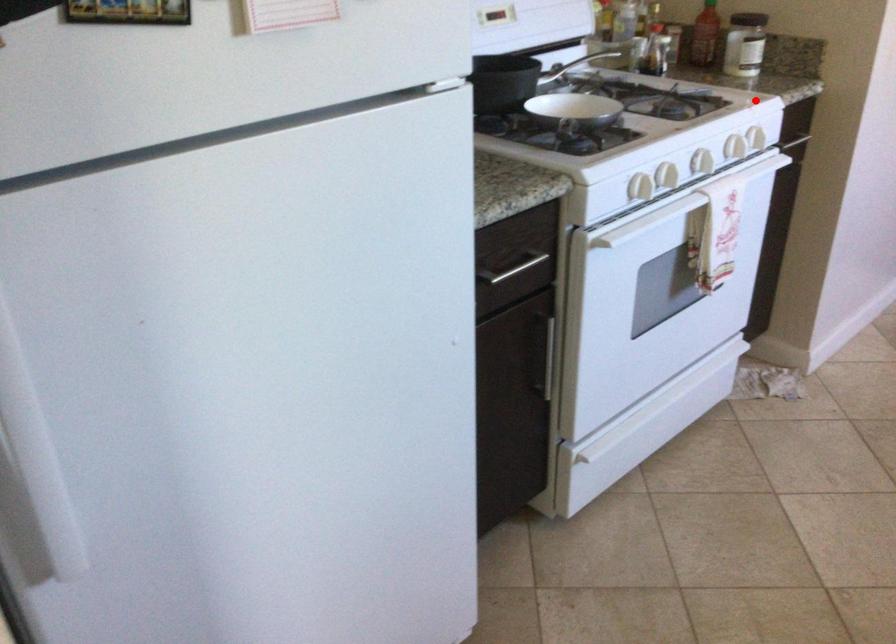
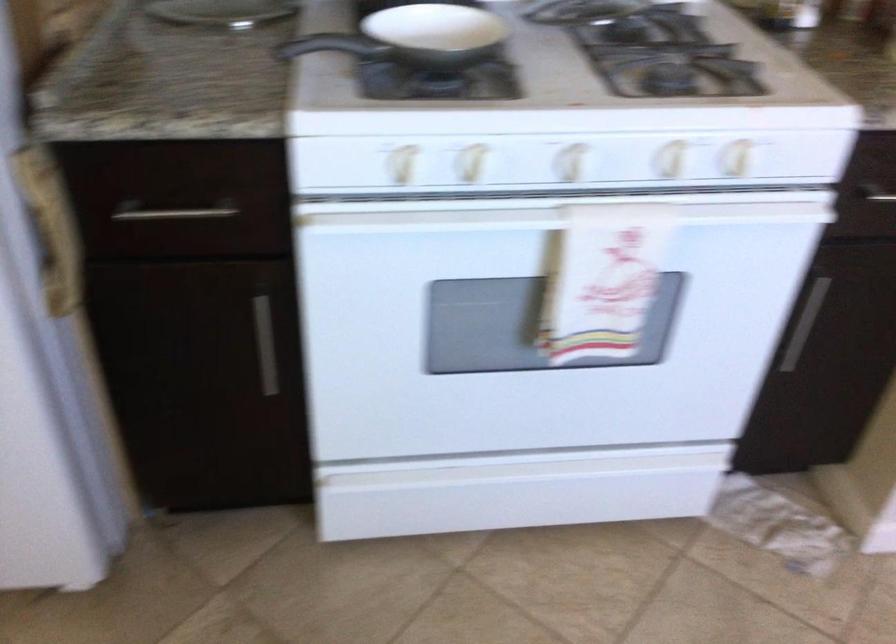
Question: A red point is marked in image1. In image2, is the corresponding 3D point closer to the camera or farther? Reply with the corresponding letter.

Choices:
 (A) The corresponding 3D point is closer.
 (B) The corresponding 3D point is farther.

Answer: (A)